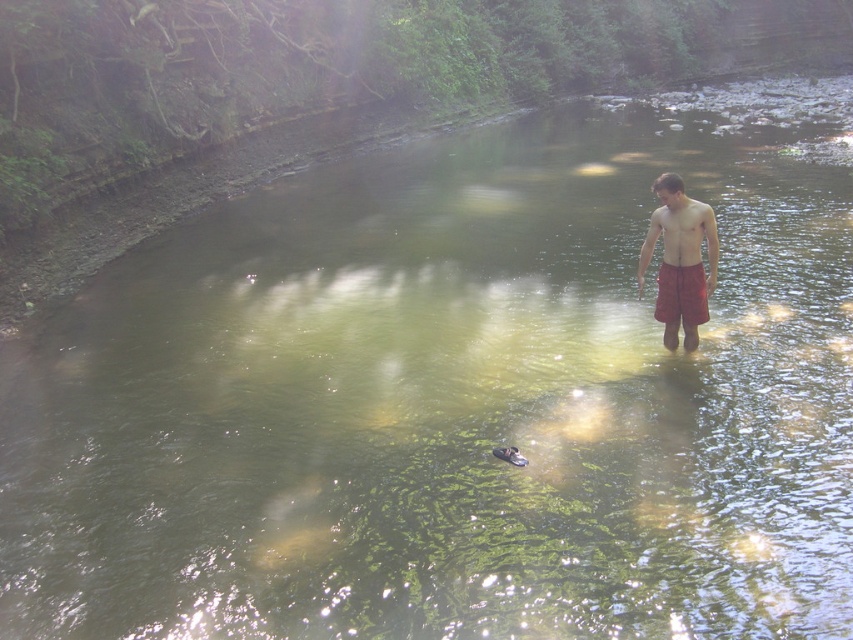
You are a photographer trying to capture the person in the scene. The person is wearing red shorts at center. To ensure the red shorts at center are in focus, where should you aim your camera? Please provide coordinates in the format of a point like point (682,232).

The matte red shorts at center are represented by point (682,232), so you should aim your camera at point (682,232) to ensure the red shorts at center are in focus.

You are a photographer trying to capture the red plaid shorts at right and the matte red shorts at center in a single frame. Given their sizes, which one would appear closer to the camera?

The red plaid shorts at right appears larger in size than the matte red shorts at center, so it would likely be closer to the camera.

You are navigating a small boat along a river and want to pass between two points marked on your map as point (666,321) and point (662,214). Which point should you aim to pass in front of first?

You should aim to pass point (662,214) first because point (666,321) is behind it, meaning the boat should navigate towards the point that is closer to the starting position.